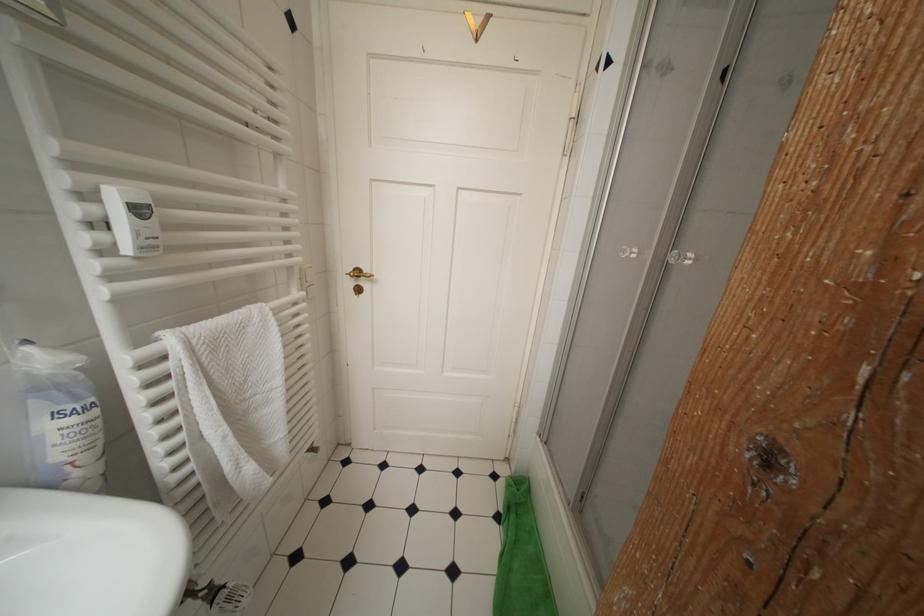
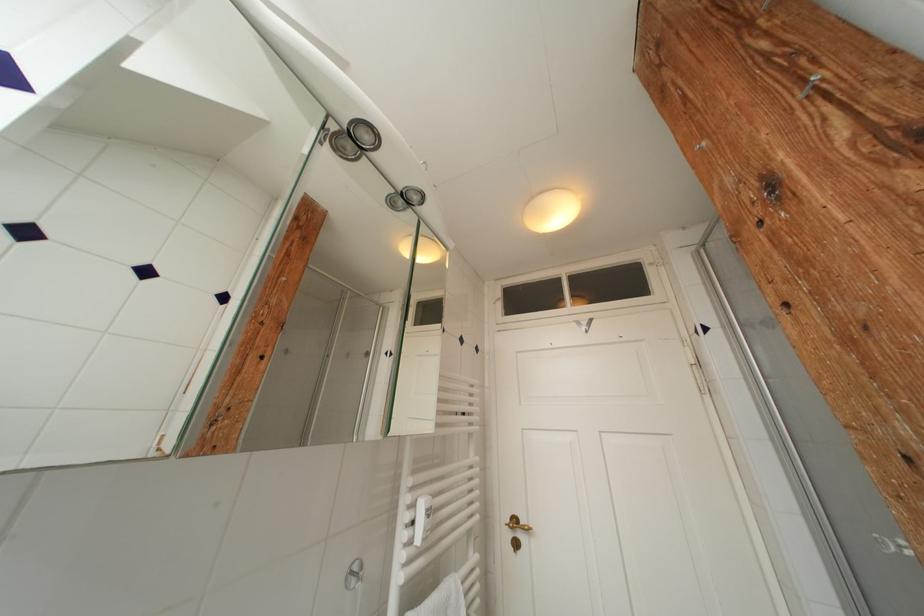
Where in the second image is the point corresponding to [359,286] from the first image?

(516, 539)